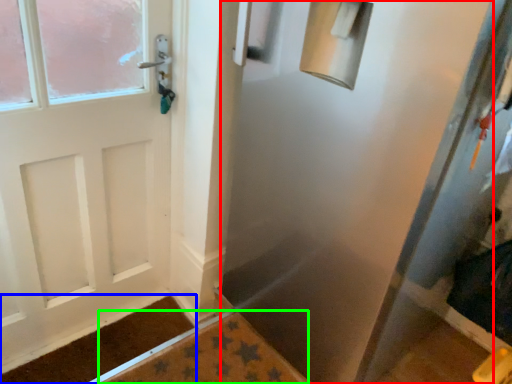
Question: Which is farther away from screen door (highlighted by a red box)? doormat (highlighted by a blue box) or bath mat (highlighted by a green box)?

Choices:
 (A) doormat
 (B) bath mat

Answer: (A)